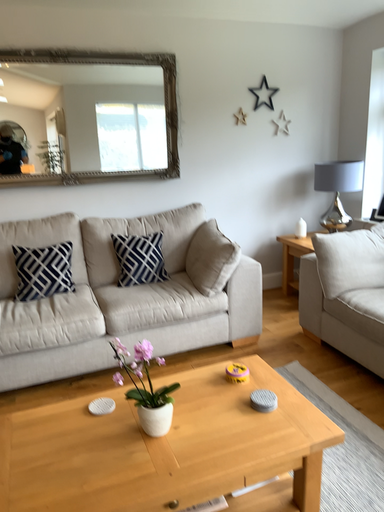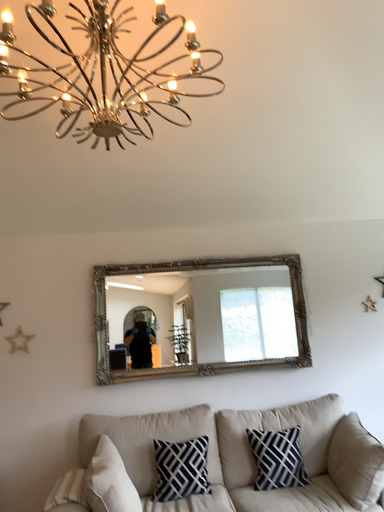
Question: How did the camera likely rotate when shooting the video?

Choices:
 (A) rotated downward
 (B) rotated upward

Answer: (B)